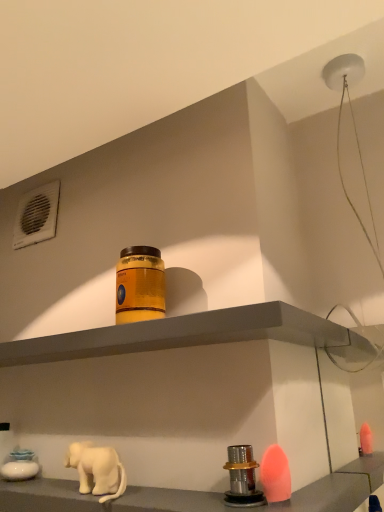
What do you see at coordinates (198, 336) in the screenshot? I see `matte gray shelf at center, acting as the second shelf starting from the bottom` at bounding box center [198, 336].

In order to face matte gray shelf at center, the 1th shelf when ordered from top to bottom, should I rotate leftwards or rightwards?

Turn left by 11.203 degrees to look at matte gray shelf at center, the 1th shelf when ordered from top to bottom.

This screenshot has height=512, width=384. I want to click on matte gray shelf at center, acting as the second shelf starting from the bottom, so click(x=198, y=336).

Considering the sizes of objects metallic silver knob at lower center, marked as the 2th shelf in a top-to-bottom arrangement, and white matte elephant at lower left in the image provided, who is smaller, metallic silver knob at lower center, marked as the 2th shelf in a top-to-bottom arrangement, or white matte elephant at lower left?

With smaller size is white matte elephant at lower left.

Which is less distant, (172, 502) or (84, 450)?

Point (172, 502).

Is metallic silver knob at lower center, which appears as the first shelf when ordered from the bottom, outside of white matte elephant at lower left?

Absolutely, metallic silver knob at lower center, which appears as the first shelf when ordered from the bottom, is external to white matte elephant at lower left.

Is orange matte jar at center situated inside white matte elephant at lower left or outside?

orange matte jar at center is spatially situated outside white matte elephant at lower left.

Considering the points (154, 268) and (95, 464), which point is in front, point (154, 268) or point (95, 464)?

The point (95, 464) is more forward.

Considering the sizes of objects orange matte jar at center and white matte elephant at lower left in the image provided, who is taller, orange matte jar at center or white matte elephant at lower left?

orange matte jar at center is taller.

Which object is further away from the camera, orange matte jar at center or white matte elephant at lower left?

orange matte jar at center is more distant.

Based on their sizes in the image, would you say orange matte jar at center is bigger or smaller than matte gray shelf at center, acting as the second shelf starting from the bottom?

orange matte jar at center is smaller than matte gray shelf at center, acting as the second shelf starting from the bottom.

Is orange matte jar at center aimed at matte gray shelf at center, the 1th shelf when ordered from top to bottom?

No.

Is orange matte jar at center closer to camera compared to matte gray shelf at center, acting as the second shelf starting from the bottom?

That is False.

From the image's perspective, is orange matte jar at center located above matte gray shelf at center, acting as the second shelf starting from the bottom?

Indeed, from the image's perspective, orange matte jar at center is shown above matte gray shelf at center, acting as the second shelf starting from the bottom.

Which of these two, matte gray shelf at center, acting as the second shelf starting from the bottom, or metallic silver knob at lower center, which appears as the first shelf when ordered from the bottom, is wider?

matte gray shelf at center, acting as the second shelf starting from the bottom.

Where is `shelf located underneath the matte gray shelf at center, acting as the second shelf starting from the bottom (from a real-world perspective)`? shelf located underneath the matte gray shelf at center, acting as the second shelf starting from the bottom (from a real-world perspective) is located at coordinates (103, 504).

Is matte gray shelf at center, acting as the second shelf starting from the bottom, positioned in front of metallic silver knob at lower center, marked as the 2th shelf in a top-to-bottom arrangement?

That is False.

Looking at this image, is metallic silver knob at lower center, marked as the 2th shelf in a top-to-bottom arrangement, at the back of matte gray shelf at center, the 1th shelf when ordered from top to bottom?

No.

Is white matte elephant at lower left aimed at matte gray shelf at center, acting as the second shelf starting from the bottom?

No, white matte elephant at lower left does not turn towards matte gray shelf at center, acting as the second shelf starting from the bottom.

Between white matte elephant at lower left and matte gray shelf at center, the 1th shelf when ordered from top to bottom, which one has larger size?

matte gray shelf at center, the 1th shelf when ordered from top to bottom.

From a real-world perspective, is white matte elephant at lower left physically located above or below matte gray shelf at center, acting as the second shelf starting from the bottom?

From a real-world perspective, white matte elephant at lower left is physically below matte gray shelf at center, acting as the second shelf starting from the bottom.

Who is smaller, metallic silver knob at lower center, marked as the 2th shelf in a top-to-bottom arrangement, or matte gray shelf at center, the 1th shelf when ordered from top to bottom?

matte gray shelf at center, the 1th shelf when ordered from top to bottom.

Is point (381, 476) positioned behind point (198, 331)?

That is True.

Who is shorter, metallic silver knob at lower center, marked as the 2th shelf in a top-to-bottom arrangement, or matte gray shelf at center, the 1th shelf when ordered from top to bottom?

matte gray shelf at center, the 1th shelf when ordered from top to bottom, is shorter.

Locate an element on the screen. bottle lying above the metallic silver knob at lower center, which appears as the first shelf when ordered from the bottom (from the image's perspective) is located at coordinates (140, 285).

Is metallic silver knob at lower center, which appears as the first shelf when ordered from the bottom, spatially inside orange matte jar at center, or outside of it?

metallic silver knob at lower center, which appears as the first shelf when ordered from the bottom, lies outside orange matte jar at center.

From their relative heights in the image, would you say metallic silver knob at lower center, which appears as the first shelf when ordered from the bottom, is taller or shorter than orange matte jar at center?

Considering their sizes, metallic silver knob at lower center, which appears as the first shelf when ordered from the bottom, has less height than orange matte jar at center.

Does metallic silver knob at lower center, which appears as the first shelf when ordered from the bottom, have a larger size compared to orange matte jar at center?

Correct, metallic silver knob at lower center, which appears as the first shelf when ordered from the bottom, is larger in size than orange matte jar at center.

Where is `the 2nd shelf in front of the white matte elephant at lower left, starting your count from the anchor`? The height and width of the screenshot is (512, 384). the 2nd shelf in front of the white matte elephant at lower left, starting your count from the anchor is located at coordinates (103, 504).

Find the location of `bottle that appears above the white matte elephant at lower left (from the image's perspective)`. bottle that appears above the white matte elephant at lower left (from the image's perspective) is located at coordinates (140, 285).

Estimate the real-world distances between objects in this image. Which object is further from orange matte jar at center, metallic silver knob at lower center, which appears as the first shelf when ordered from the bottom, or white matte elephant at lower left?

Among the two, metallic silver knob at lower center, which appears as the first shelf when ordered from the bottom, is located further to orange matte jar at center.

Which object lies nearer to the anchor point orange matte jar at center, metallic silver knob at lower center, which appears as the first shelf when ordered from the bottom, or matte gray shelf at center, acting as the second shelf starting from the bottom?

matte gray shelf at center, acting as the second shelf starting from the bottom, is closer to orange matte jar at center.

Looking at the image, which one is located closer to matte gray shelf at center, the 1th shelf when ordered from top to bottom, white matte elephant at lower left or orange matte jar at center?

orange matte jar at center is positioned closer to the anchor matte gray shelf at center, the 1th shelf when ordered from top to bottom.

Looking at the image, which one is located closer to orange matte jar at center, white matte elephant at lower left or metallic silver knob at lower center, marked as the 2th shelf in a top-to-bottom arrangement?

The object closer to orange matte jar at center is white matte elephant at lower left.

Considering their positions, is orange matte jar at center positioned closer to white matte elephant at lower left than matte gray shelf at center, the 1th shelf when ordered from top to bottom?

Among the two, matte gray shelf at center, the 1th shelf when ordered from top to bottom, is located nearer to white matte elephant at lower left.

Consider the image. Considering their positions, is metallic silver knob at lower center, which appears as the first shelf when ordered from the bottom, positioned further to matte gray shelf at center, the 1th shelf when ordered from top to bottom, than white matte elephant at lower left?

Based on the image, white matte elephant at lower left appears to be further to matte gray shelf at center, the 1th shelf when ordered from top to bottom.

Which object lies nearer to the anchor point white matte elephant at lower left, metallic silver knob at lower center, marked as the 2th shelf in a top-to-bottom arrangement, or matte gray shelf at center, the 1th shelf when ordered from top to bottom?

The object closer to white matte elephant at lower left is metallic silver knob at lower center, marked as the 2th shelf in a top-to-bottom arrangement.

Based on their spatial positions, is metallic silver knob at lower center, marked as the 2th shelf in a top-to-bottom arrangement, or orange matte jar at center closer to white matte elephant at lower left?

Based on the image, metallic silver knob at lower center, marked as the 2th shelf in a top-to-bottom arrangement, appears to be nearer to white matte elephant at lower left.

Identify the location of shelf between orange matte jar at center and white matte elephant at lower left in the vertical direction. (198, 336).

Where is `shelf between orange matte jar at center and metallic silver knob at lower center, marked as the 2th shelf in a top-to-bottom arrangement, in the vertical direction`? shelf between orange matte jar at center and metallic silver knob at lower center, marked as the 2th shelf in a top-to-bottom arrangement, in the vertical direction is located at coordinates (198, 336).

The width and height of the screenshot is (384, 512). I want to click on elephant between matte gray shelf at center, the 1th shelf when ordered from top to bottom, and metallic silver knob at lower center, marked as the 2th shelf in a top-to-bottom arrangement, in the up-down direction, so click(97, 470).

Locate an element on the screen. This screenshot has height=512, width=384. elephant between orange matte jar at center and metallic silver knob at lower center, marked as the 2th shelf in a top-to-bottom arrangement, from top to bottom is located at coordinates (97, 470).